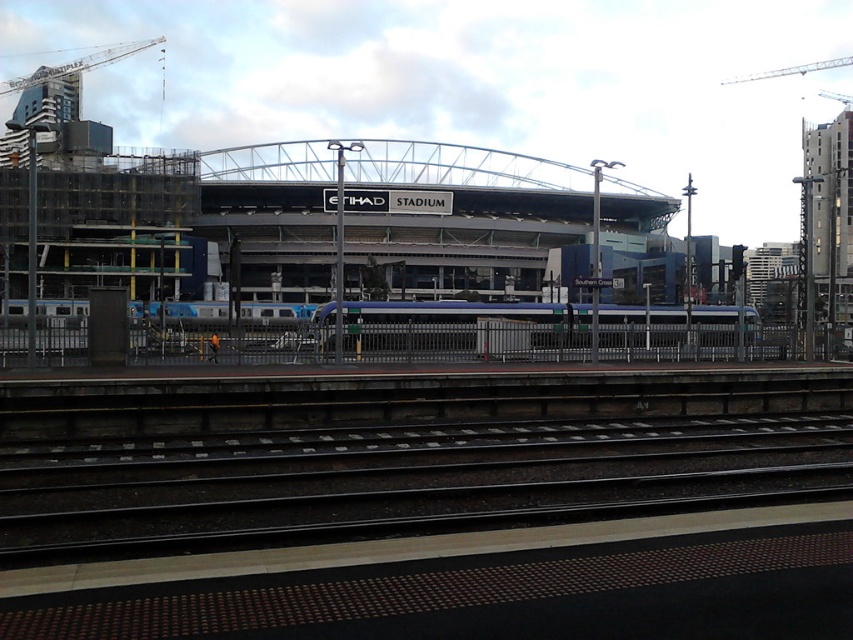
Based on the photo, does black asphalt train track at center come in front of blue metallic train at center?

Yes, it is.

Is black asphalt train track at center shorter than blue metallic train at center?

Yes, black asphalt train track at center is shorter than blue metallic train at center.

Between point (612, 493) and point (473, 346), which one is positioned behind?

Positioned behind is point (473, 346).

I want to click on black asphalt train track at center, so click(x=409, y=477).

Is point (637, 476) positioned before point (3, 88)?

Yes, it is in front of point (3, 88).

Who is positioned more to the right, black asphalt train track at center or metallic gray crane at upper left?

black asphalt train track at center

At what (x,y) coordinates should I click in order to perform the action: click on black asphalt train track at center. Please return your answer as a coordinate pair (x, y). Looking at the image, I should click on (409, 477).

Does blue metallic train at center have a lesser width compared to metallic gray crane at upper left?

Correct, blue metallic train at center's width is less than metallic gray crane at upper left's.

Is blue metallic train at center wider than metallic gray crane at upper left?

In fact, blue metallic train at center might be narrower than metallic gray crane at upper left.

Where is `blue metallic train at center`? blue metallic train at center is located at coordinates [x=468, y=324].

I want to click on blue metallic train at center, so click(x=468, y=324).